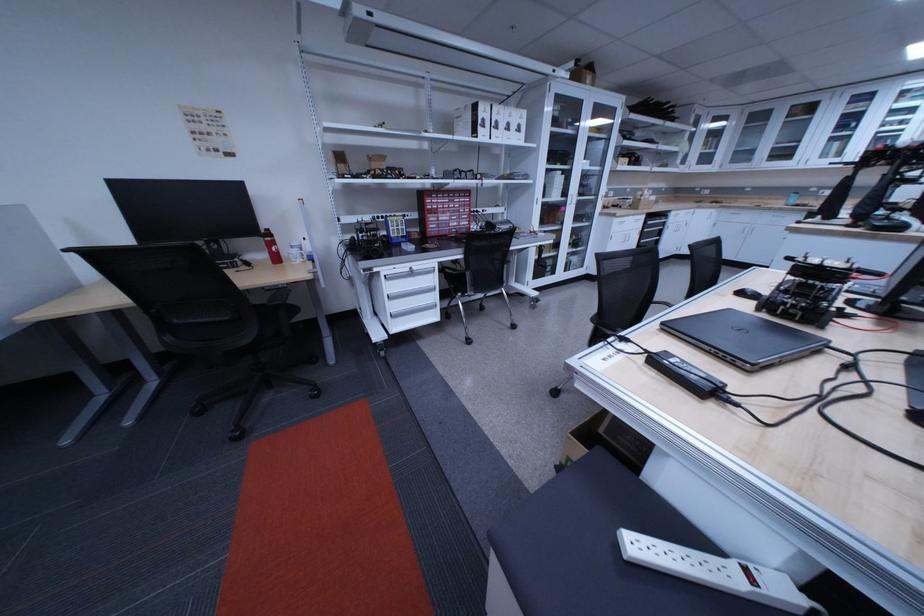
The location [272,246] corresponds to which object?

This point indicates the red water bottle.